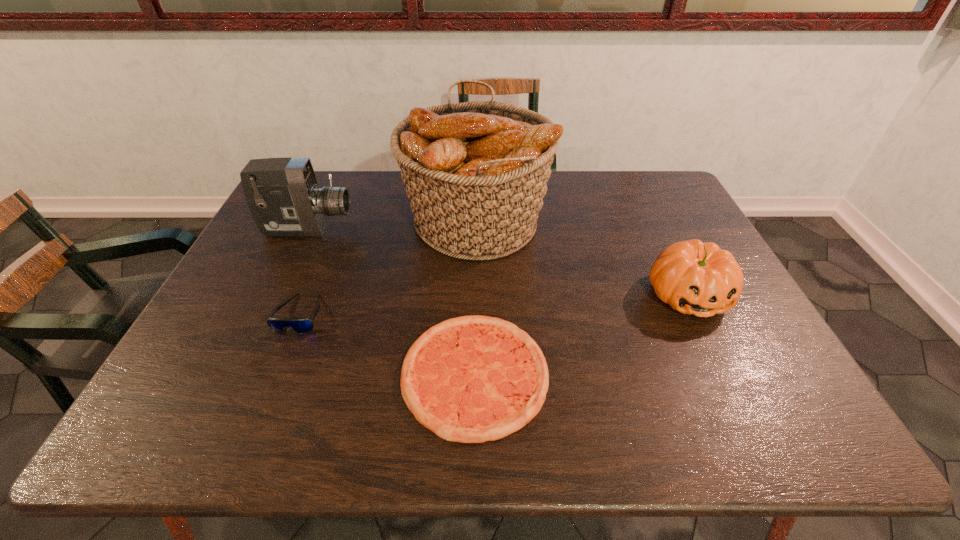
Locate which object is the fourth closest to the fourth shortest object. Please provide its 2D coordinates. Your answer should be formatted as a tuple, i.e. [(x, y)], where the tuple contains the x and y coordinates of a point satisfying the conditions above.

[(693, 277)]

In order to click on the second closest object to the sunglasses in this screenshot , I will do `click(470, 379)`.

Find the location of a particular element. The image size is (960, 540). free space in the image that satisfies the following two spatial constraints: 1. on the front-facing side of the pizza; 2. on the right side of the second shortest object is located at coordinates (276, 374).

This screenshot has height=540, width=960. What are the coordinates of `vacant region that satisfies the following two spatial constraints: 1. on the front-facing side of the pizza; 2. on the right side of the second shortest object` in the screenshot? It's located at (276, 374).